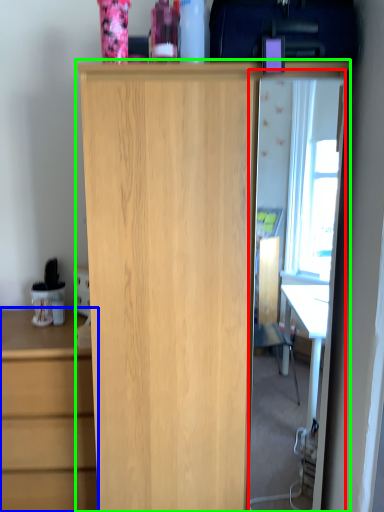
Question: Which object is the farthest from glass door (highlighted by a red box)? Choose among these: chest of drawers (highlighted by a blue box) or cupboard (highlighted by a green box).

Choices:
 (A) chest of drawers
 (B) cupboard

Answer: (B)